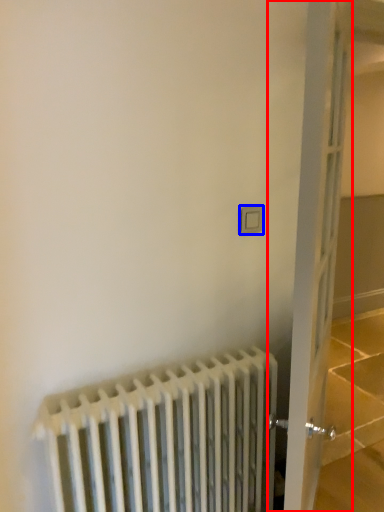
Question: Which point is closer to the camera, door (highlighted by a red box) or electric outlet (highlighted by a blue box)?

Choices:
 (A) door
 (B) electric outlet

Answer: (A)